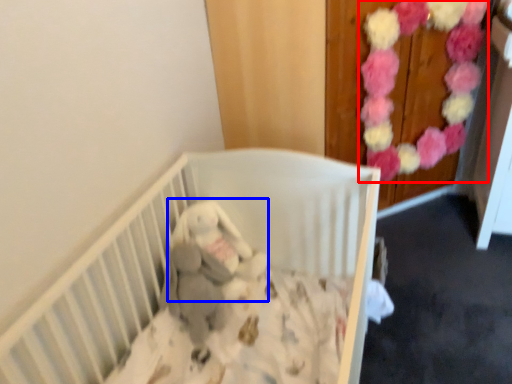
Question: Which object appears farthest to the camera in this image, flower (highlighted by a red box) or baby elephant (highlighted by a blue box)?

Choices:
 (A) flower
 (B) baby elephant

Answer: (A)